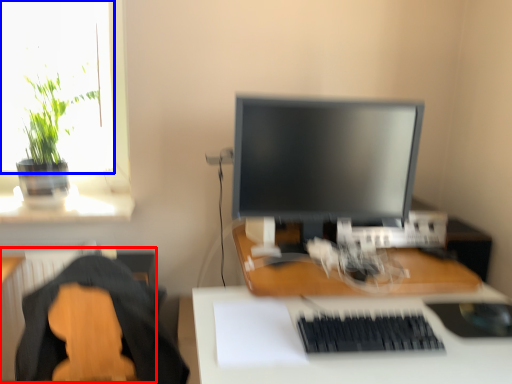
Question: Which object is closer to the camera taking this photo, radiator (highlighted by a red box) or window screen (highlighted by a blue box)?

Choices:
 (A) radiator
 (B) window screen

Answer: (A)